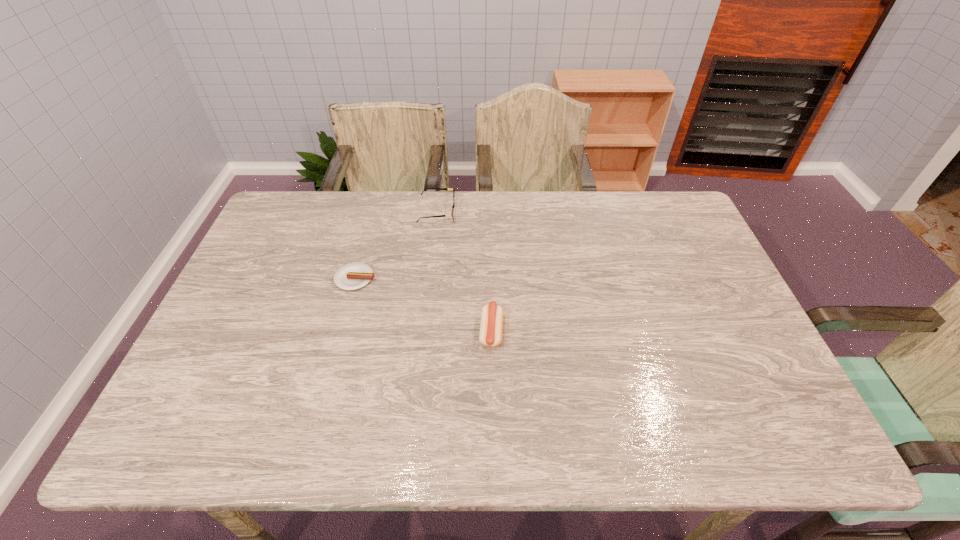
The image size is (960, 540). I want to click on free space at the far edge of the desktop, so pos(452,232).

In the image, there is a desktop. Where is `free space at the near edge`? The height and width of the screenshot is (540, 960). free space at the near edge is located at coordinates (613, 420).

You are a GUI agent. You are given a task and a screenshot of the screen. Output one action in this format:
    pyautogui.click(x=<x>, y=<y>)
    Task: Click on the free space at the left edge of the desktop
    
    Given the screenshot: What is the action you would take?
    pyautogui.click(x=200, y=366)

Where is `free location at the right edge of the desktop`? The image size is (960, 540). free location at the right edge of the desktop is located at coordinates (686, 254).

In the image, there is a desktop. In order to click on vacant space at the far left corner in this screenshot , I will do `click(293, 209)`.

At what (x,y) coordinates should I click in order to perform the action: click on free spot between the spectacles and the shorter sausage. Please return your answer as a coordinate pair (x, y). This screenshot has height=540, width=960. Looking at the image, I should click on (396, 245).

Identify the location of vacant area that lies between the second object from left to right and the taller sausage. This screenshot has width=960, height=540. (464, 272).

Locate an element on the screen. free spot between the farther sausage and the nearest object is located at coordinates (423, 305).

At what (x,y) coordinates should I click in order to perform the action: click on free spot between the farthest object and the left sausage. Please return your answer as a coordinate pair (x, y). This screenshot has height=540, width=960. Looking at the image, I should click on (396, 245).

Locate an element on the screen. The image size is (960, 540). free space between the farther sausage and the second object from left to right is located at coordinates (396, 245).